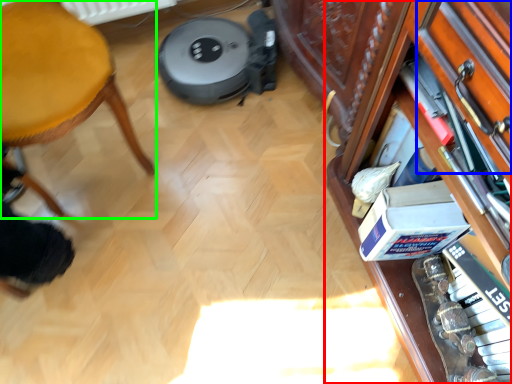
Question: Which object is positioned closest to shelf (highlighted by a red box)? Select from drawer (highlighted by a blue box) and furniture (highlighted by a green box).

Choices:
 (A) drawer
 (B) furniture

Answer: (A)